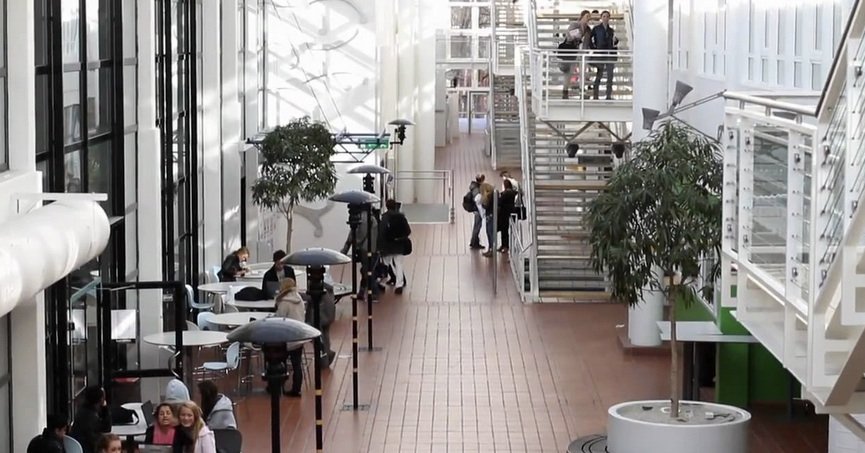
Find the location of a particular element. This screenshot has width=865, height=453. windows is located at coordinates (91, 79), (90, 313), (183, 166).